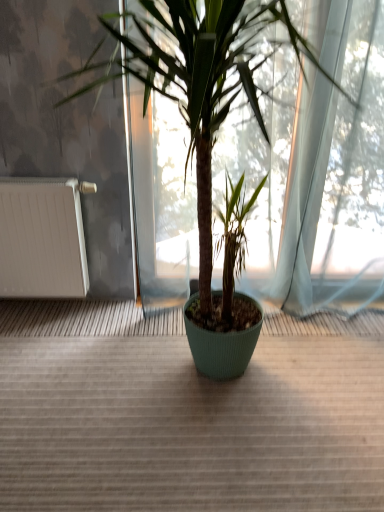
Question: Is green ribbed pot at center next to white matte radiator at left?

Choices:
 (A) no
 (B) yes

Answer: (A)

Question: Is green ribbed pot at center bigger than white matte radiator at left?

Choices:
 (A) no
 (B) yes

Answer: (B)

Question: From a real-world perspective, is green ribbed pot at center on top of white matte radiator at left?

Choices:
 (A) yes
 (B) no

Answer: (A)

Question: Is green ribbed pot at center oriented towards white matte radiator at left?

Choices:
 (A) no
 (B) yes

Answer: (A)

Question: Is green ribbed pot at center not near white matte radiator at left?

Choices:
 (A) yes
 (B) no

Answer: (B)

Question: Is the depth of green ribbed pot at center greater than that of white matte radiator at left?

Choices:
 (A) no
 (B) yes

Answer: (A)

Question: Is white matte radiator at left at the right side of green ribbed pot at center?

Choices:
 (A) no
 (B) yes

Answer: (A)

Question: Could you tell me if white matte radiator at left is turned towards green ribbed pot at center?

Choices:
 (A) yes
 (B) no

Answer: (B)

Question: Is white matte radiator at left not close to green ribbed pot at center?

Choices:
 (A) no
 (B) yes

Answer: (A)

Question: Is white matte radiator at left thinner than green ribbed pot at center?

Choices:
 (A) no
 (B) yes

Answer: (B)

Question: Does white matte radiator at left lie in front of green ribbed pot at center?

Choices:
 (A) no
 (B) yes

Answer: (A)

Question: Considering the relative positions of white matte radiator at left and green ribbed pot at center in the image provided, is white matte radiator at left to the left of green ribbed pot at center from the viewer's perspective?

Choices:
 (A) no
 (B) yes

Answer: (B)

Question: From a real-world perspective, relative to white matte radiator at left, is green ribbed pot at center vertically above or below?

Choices:
 (A) below
 (B) above

Answer: (B)